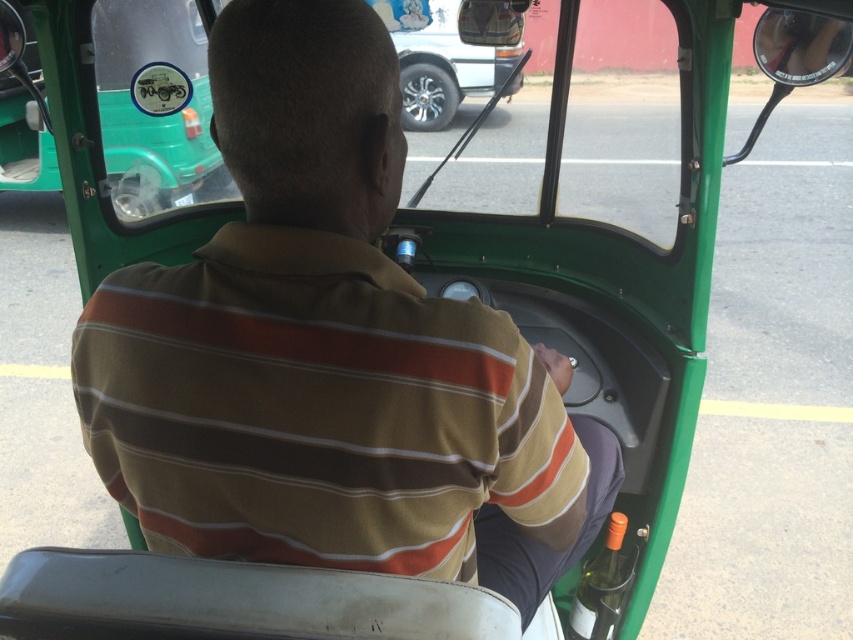
Locate an element on the screen. green matte car at upper center is located at coordinates (151, 115).

The image size is (853, 640). What are the coordinates of `green matte car at upper center` in the screenshot? It's located at (151, 115).

At what (x,y) coordinates should I click in order to perform the action: click on green matte car at upper center. Please return your answer as a coordinate pair (x, y). Looking at the image, I should click on (151, 115).

Between brown striped shirt at center and green matte car at upper center, which one has less height?

green matte car at upper center is shorter.

Between brown striped shirt at center and green matte car at upper center, which one is positioned higher?

green matte car at upper center is above.

Is point (309, 512) positioned before point (479, 84)?

That is True.

Find the location of a particular element. brown striped shirt at center is located at coordinates click(x=329, y=353).

Which of these two, brown striped shirt at center or orange matte bottle at lower right, stands taller?

Standing taller between the two is brown striped shirt at center.

Which is behind, point (508, 570) or point (616, 532)?

Point (616, 532)

Where is `brown striped shirt at center`? brown striped shirt at center is located at coordinates (329, 353).